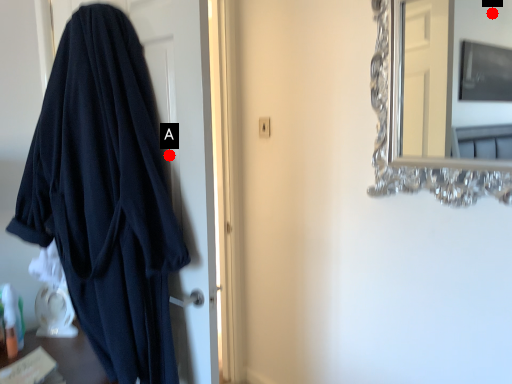
Question: Two points are circled on the image, labeled by A and B beside each circle. Which point is closer to the camera taking this photo?

Choices:
 (A) A is closer
 (B) B is closer

Answer: (A)